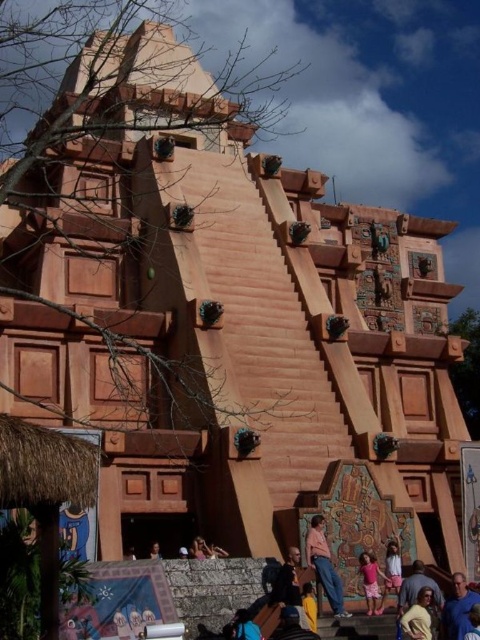
You are standing at the base of the pyramid and looking up at its structure. There are two points marked on the pyramid. One is located at coordinates point (x=324, y=547) and the other at point (x=443, y=627). From your vantage point, which point is closer to you?

Point (x=443, y=627) is closer to you because the description states that point (x=324, y=547) is behind point (x=443, y=627), meaning the latter is in front and thus nearer.

You are standing at the base of the Mayan pyramid and notice a light brown leather jacket at lower right and a blue fabric at lower center. You want to place a 20 feet long rope between them. Will the rope be sufficient to connect both items without any extension?

The light brown leather jacket at lower right is 20.98 feet from the blue fabric at lower center. Since the rope is only 20 feet long, it will be 0.98 feet short and cannot connect both items without extension.

You are standing in front of the Mayan pyramid and notice two items at the lower center of the scene. Which one takes up more space visually between the dark blue jeans at lower center and the blue fabric at lower center?

The dark blue jeans at lower center takes up more space visually than the blue fabric at lower center because it is bigger in size according to the description.